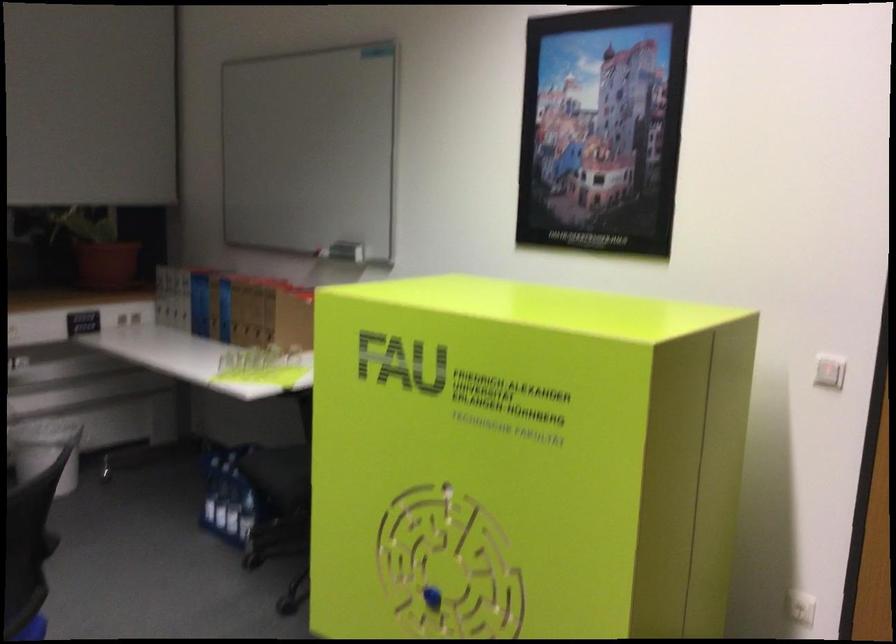
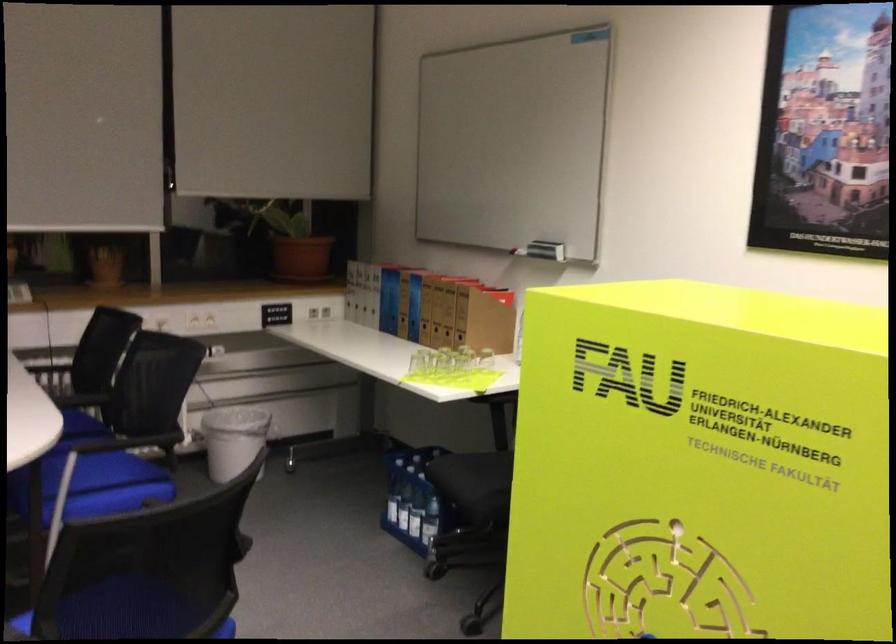
The point at (101, 251) is marked in the first image. Where is the corresponding point in the second image?

(294, 243)